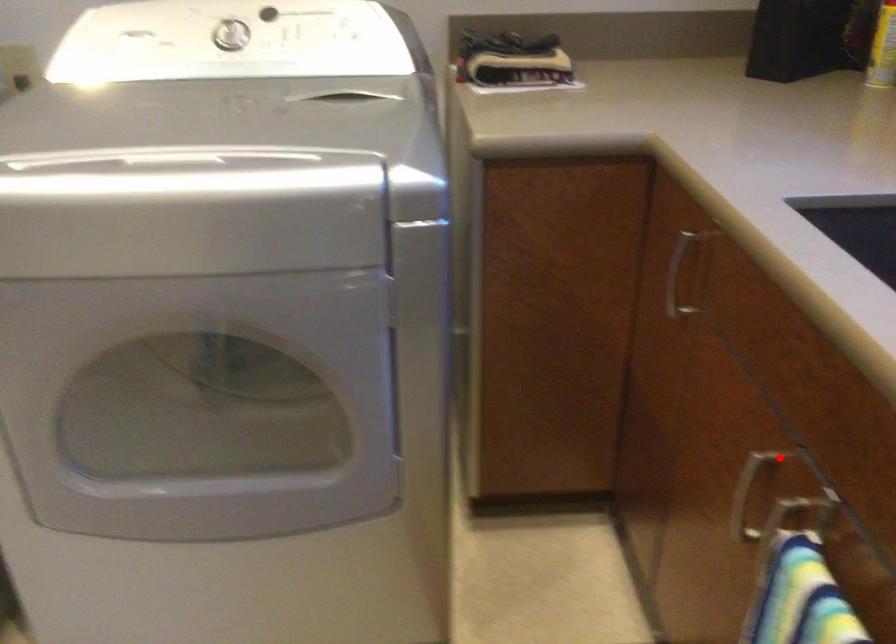
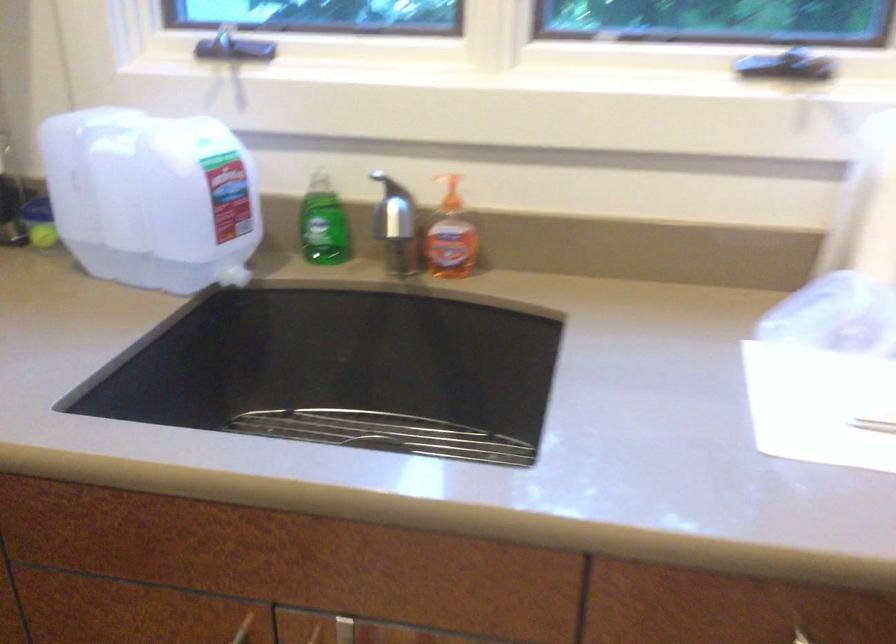
Locate, in the second image, the point that corresponds to the highlighted location in the first image.

(243, 629)